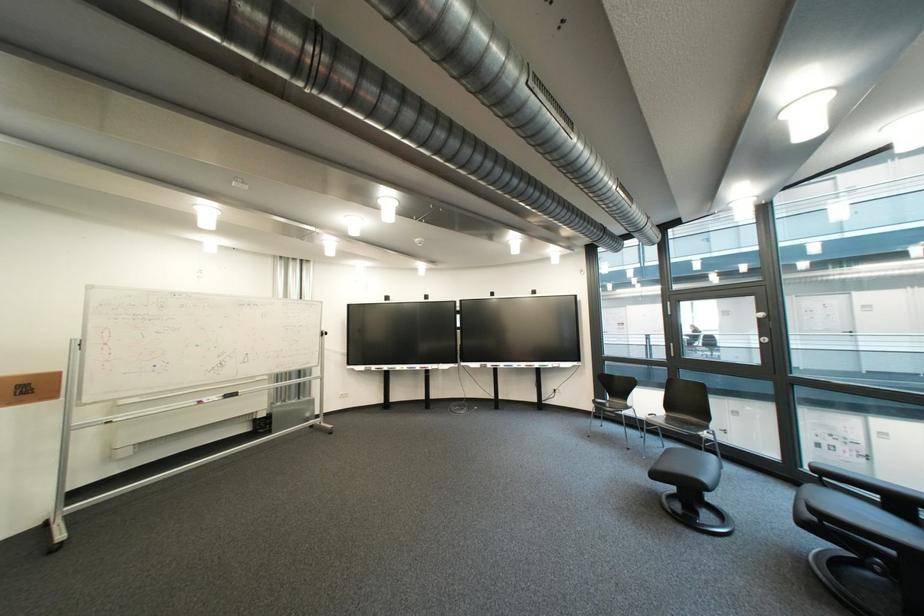
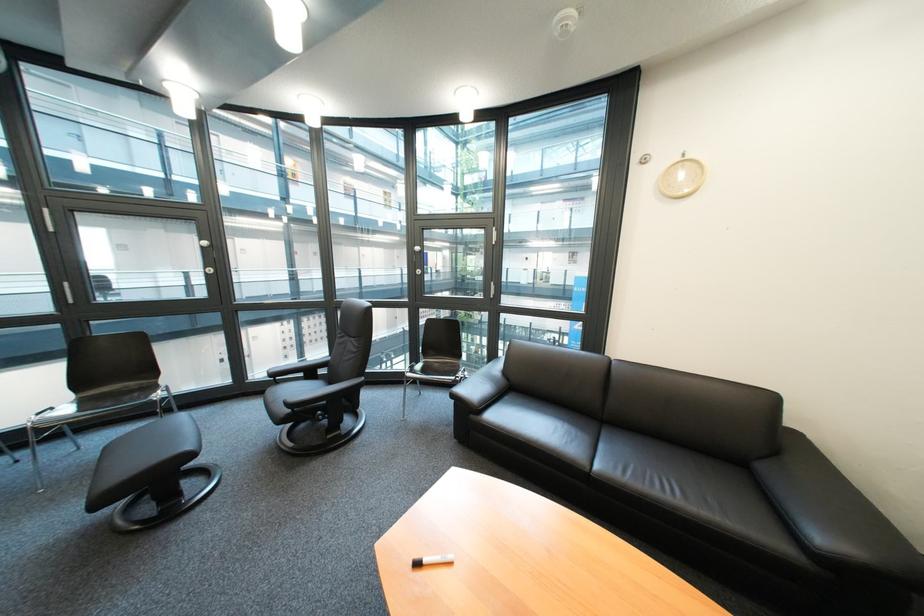
Question: The camera is either moving clockwise (left) or counter-clockwise (right) around the object. The first image is from the beginning of the video and the second image is from the end. Is the camera moving left or right when shooting the video?

Choices:
 (A) Left
 (B) Right

Answer: (A)